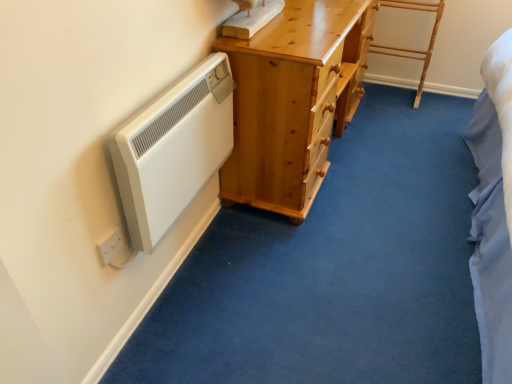
Question: From a real-world perspective, relative to white matte radiator at left, is light wood/rough textured ladder at upper right vertically above or below?

Choices:
 (A) below
 (B) above

Answer: (A)

Question: From the image's perspective, is light wood/rough textured ladder at upper right positioned above or below white matte radiator at left?

Choices:
 (A) above
 (B) below

Answer: (A)

Question: Considering the real-world distances, which object is farthest from the white plastic electric outlet at lower left?

Choices:
 (A) light brown wooden chest of drawers at center
 (B) white matte radiator at left
 (C) light wood/rough textured ladder at upper right

Answer: (C)

Question: Which object is the farthest from the light wood/rough textured ladder at upper right?

Choices:
 (A) white plastic electric outlet at lower left
 (B) light brown wooden chest of drawers at center
 (C) white matte radiator at left

Answer: (A)